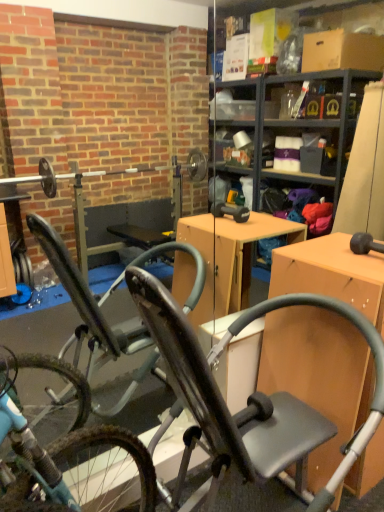
Question: Is matte wood desk at right bigger or smaller than metallic gray exercise bike at center?

Choices:
 (A) small
 (B) big

Answer: (A)

Question: From a real-world perspective, is matte wood desk at right positioned above or below metallic gray exercise bike at center?

Choices:
 (A) below
 (B) above

Answer: (A)

Question: In terms of height, does matte wood desk at right look taller or shorter compared to metallic gray exercise bike at center?

Choices:
 (A) short
 (B) tall

Answer: (A)

Question: From a real-world perspective, is metallic gray exercise bike at center above or below matte wood desk at right?

Choices:
 (A) above
 (B) below

Answer: (A)

Question: In the image, is metallic gray exercise bike at center positioned in front of or behind matte wood desk at right?

Choices:
 (A) front
 (B) behind

Answer: (A)

Question: In terms of height, does metallic gray exercise bike at center look taller or shorter compared to matte wood desk at right?

Choices:
 (A) tall
 (B) short

Answer: (A)

Question: Is metallic gray exercise bike at center inside or outside of matte wood desk at right?

Choices:
 (A) inside
 (B) outside

Answer: (B)